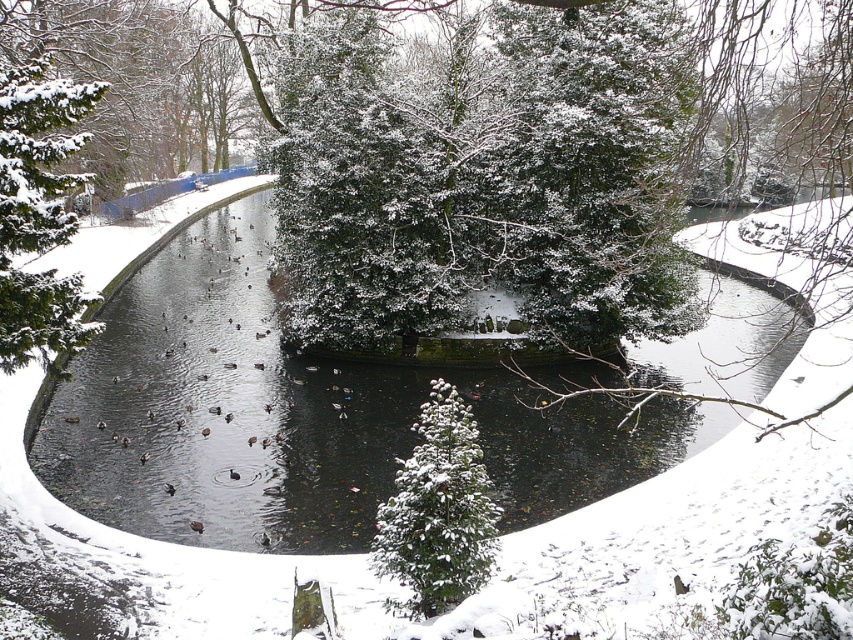
You are standing at the edge of the snow covered pond and see the point marked at coordinate (299, 417). What is the color of the surface at that point?

The point at coordinate (299, 417) indicates black water at center, so the surface at that point is black.